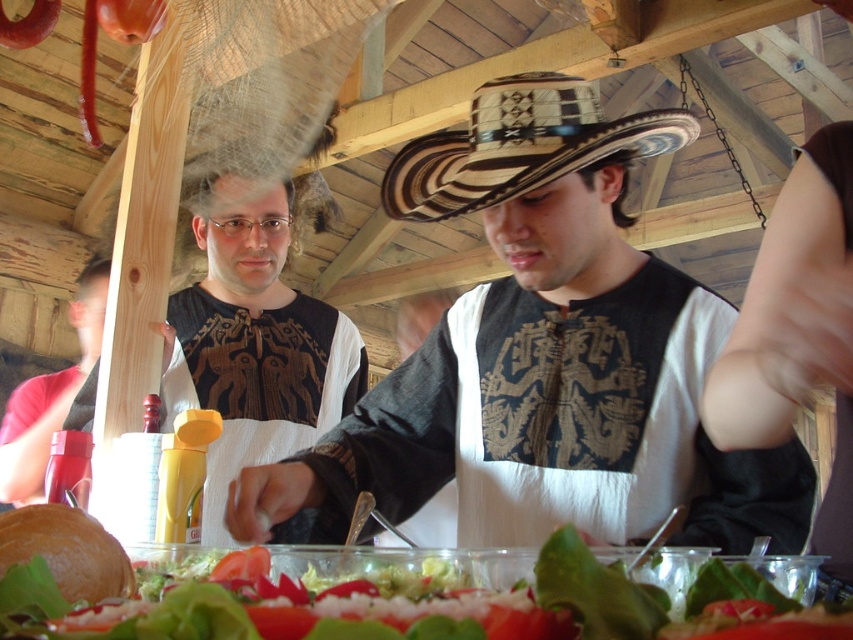
Question: Which point is closer to the camera taking this photo?

Choices:
 (A) (469, 515)
 (B) (494, 195)

Answer: (B)

Question: Can you confirm if matte black vest at center is positioned to the left of brown woven straw cowboy hat at center?

Choices:
 (A) no
 (B) yes

Answer: (B)

Question: Can you confirm if matte black vest at center is wider than brown woven straw cowboy hat at center?

Choices:
 (A) no
 (B) yes

Answer: (B)

Question: Which point is closer to the camera taking this photo?

Choices:
 (A) (769, 492)
 (B) (693, 140)

Answer: (A)

Question: Does matte black vest at center have a greater width compared to brown woven straw cowboy hat at center?

Choices:
 (A) no
 (B) yes

Answer: (B)

Question: Which of the following is the closest to the observer?

Choices:
 (A) matte black vest at center
 (B) brown woven straw cowboy hat at center

Answer: (A)